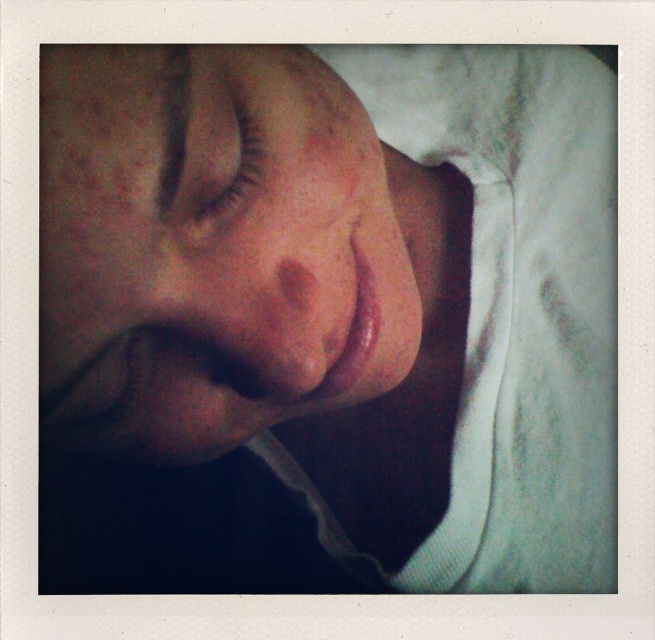
Is smooth skin face at center thinner than brown matte eyelashes at upper center?

In fact, smooth skin face at center might be wider than brown matte eyelashes at upper center.

In the scene shown: Who is lower down, smooth skin face at center or brown matte eyelashes at upper center?

smooth skin face at center is lower down.

Who is more distant from viewer, (x=326, y=374) or (x=212, y=113)?

The point (x=326, y=374) is behind.

Find the location of `smooth skin face at center`. smooth skin face at center is located at coordinates (210, 248).